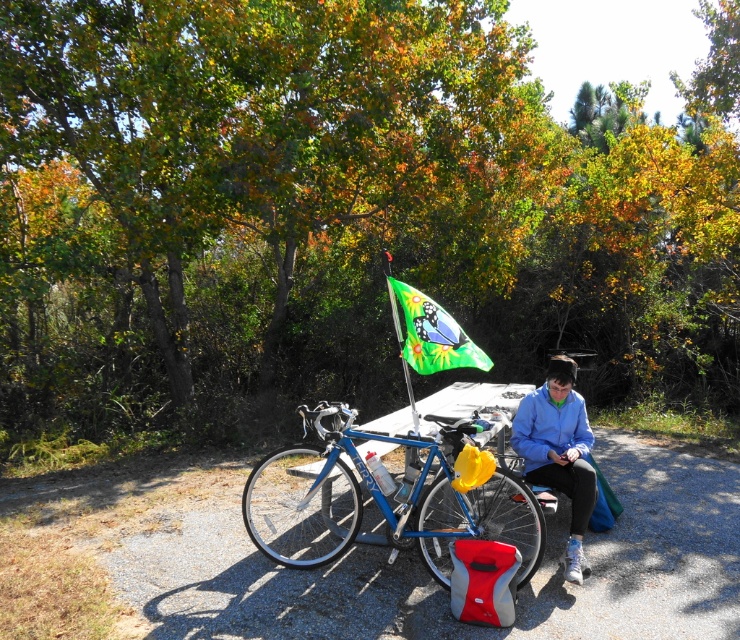
Is blue metallic bicycle at center to the left of green fabric flag at center from the viewer's perspective?

Yes, blue metallic bicycle at center is to the left of green fabric flag at center.

Between blue metallic bicycle at center and green fabric flag at center, which one appears on the left side from the viewer's perspective?

blue metallic bicycle at center is more to the left.

Where is `blue metallic bicycle at center`? The height and width of the screenshot is (640, 740). blue metallic bicycle at center is located at coordinates point(380,499).

Image resolution: width=740 pixels, height=640 pixels. Identify the location of blue metallic bicycle at center. (380, 499).

Is blue metallic bicycle at center shorter than blue fabric jacket at center?

Correct, blue metallic bicycle at center is not as tall as blue fabric jacket at center.

What do you see at coordinates (380, 499) in the screenshot? I see `blue metallic bicycle at center` at bounding box center [380, 499].

This screenshot has width=740, height=640. What do you see at coordinates (380, 499) in the screenshot?
I see `blue metallic bicycle at center` at bounding box center [380, 499].

Find the location of a particular element. This screenshot has width=740, height=640. blue metallic bicycle at center is located at coordinates (380, 499).

Between point (561, 452) and point (451, 352), which one is positioned behind?

The point (561, 452) is behind.

Does blue fabric jacket at center appear on the right side of green fabric flag at center?

Correct, you'll find blue fabric jacket at center to the right of green fabric flag at center.

The width and height of the screenshot is (740, 640). Describe the element at coordinates (559, 451) in the screenshot. I see `blue fabric jacket at center` at that location.

Identify the location of blue fabric jacket at center. (559, 451).